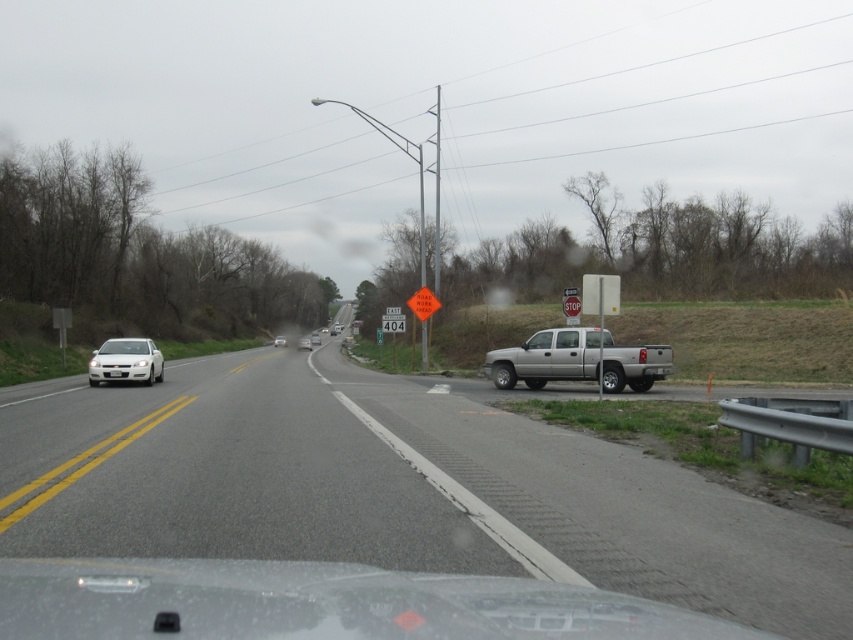
You are a pedestrian standing at the edge of the road near the parked silver pickup truck. You want to cross the road to reach the grassy area with the trees. The road has two lanes, and there is a white car moving away from you. There is a gap between the white glossy windshield at left and the clear glass windshield at right. Do you think you can safely cross the road within this gap before the white car reaches you? Please consider the distance between the two windshields and the speed of the white car.

The distance between the white glossy windshield at left and the clear glass windshield at right is 54.82 feet. Assuming the white car is moving at a moderate speed, this distance should be sufficient for a pedestrian to safely cross the road before the white car reaches the crossing point. However, always check for oncoming traffic and ensure it is safe before crossing.

You are driving a car that requires a 50 meter space to safely stop. You see the white matte sedan at left and the silver metallic sedan at center on the road. Is there enough space between them for your car to safely stop if needed?

The distance between the white matte sedan at left and the silver metallic sedan at center is 67.99 meters, which is more than the required 50 meters. Therefore, there is enough space for your car to safely stop.